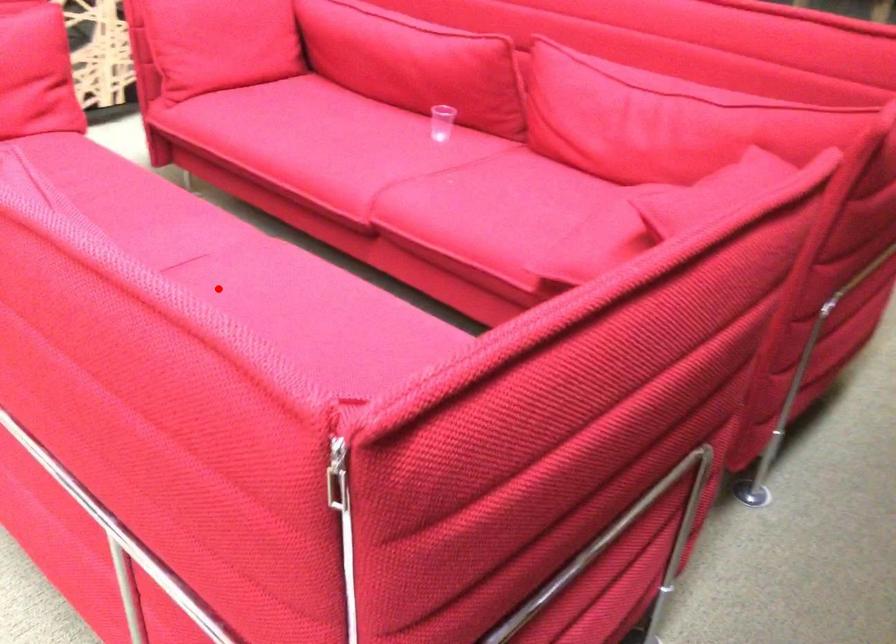
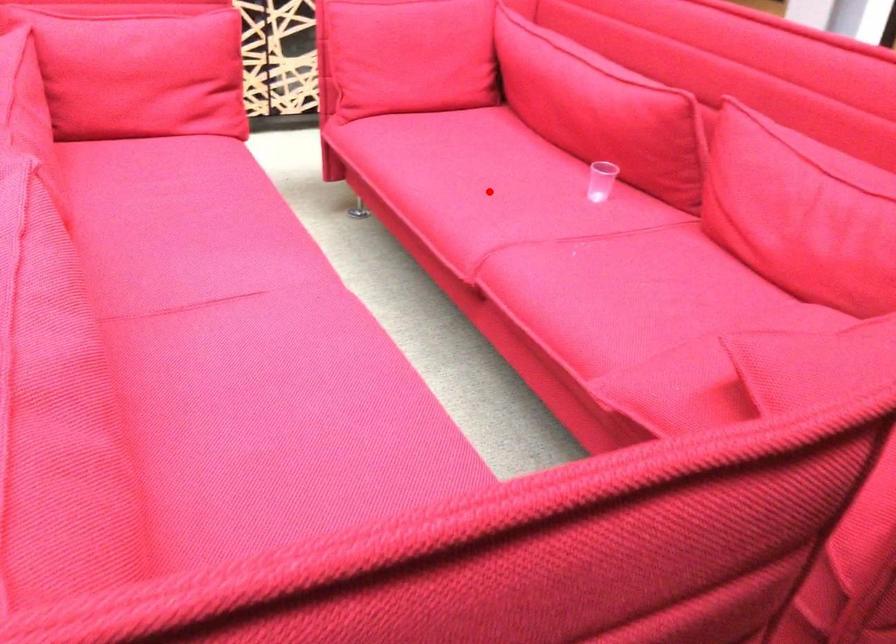
I am providing you with two images of the same scene from different viewpoints. A red point is marked on the first image and another point is marked on the second image. Does the point marked in image1 correspond to the same location as the one in image2?

No